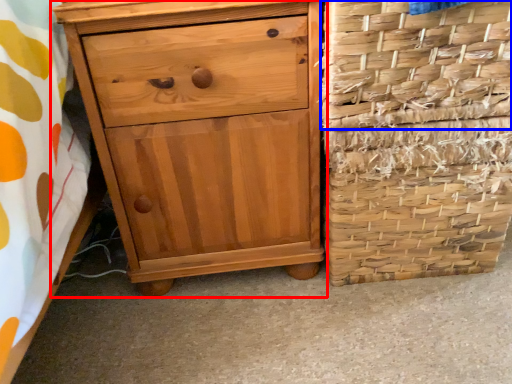
Question: Among these objects, which one is nearest to the camera, chest of drawers (highlighted by a red box) or basket (highlighted by a blue box)?

Choices:
 (A) chest of drawers
 (B) basket

Answer: (B)